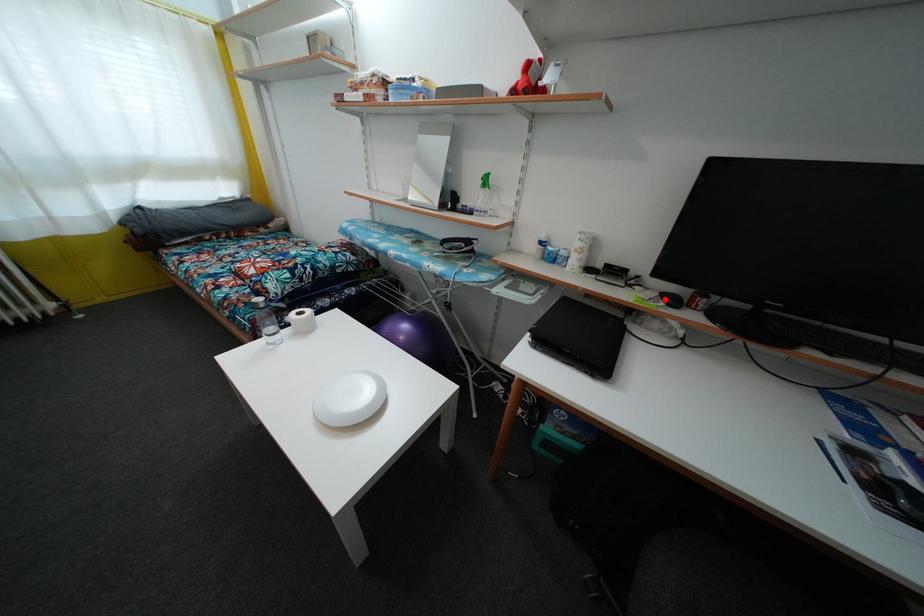
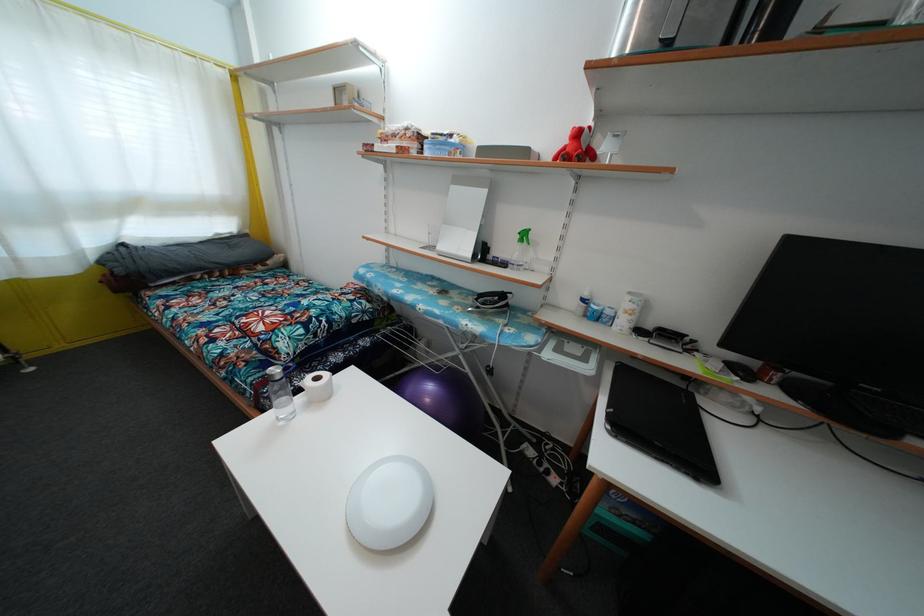
Locate, in the second image, the point that corresponds to the highlighted location in the first image.

(728, 369)